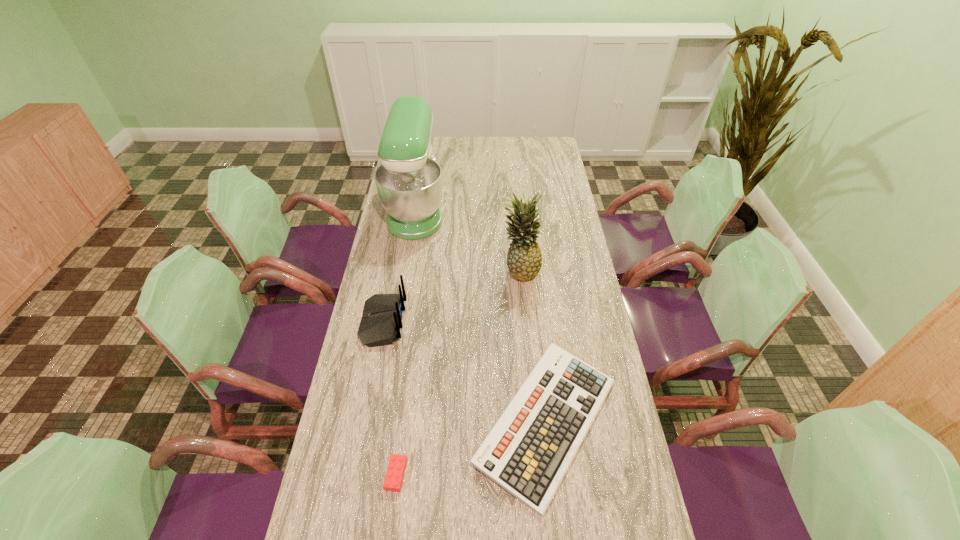
Image resolution: width=960 pixels, height=540 pixels. I want to click on blank space located on the back of the third farthest object, so click(507, 322).

You are a GUI agent. You are given a task and a screenshot of the screen. Output one action in this format:
    pyautogui.click(x=<x>, y=<y>)
    Task: Click on the vacant space located on the back of the fourth tallest object
    This screenshot has width=960, height=540.
    Given the screenshot: What is the action you would take?
    pyautogui.click(x=530, y=267)

Find the location of `free location located 0.370m on the back of the shortest object`. free location located 0.370m on the back of the shortest object is located at coordinates (413, 342).

The width and height of the screenshot is (960, 540). Identify the location of mixer that is at the left edge. pos(409,180).

The image size is (960, 540). I want to click on router located in the left edge section of the desktop, so click(x=382, y=313).

Locate an element on the screen. The image size is (960, 540). Lego that is at the left edge is located at coordinates (394, 477).

You are a GUI agent. You are given a task and a screenshot of the screen. Output one action in this format:
    pyautogui.click(x=<x>, y=<y>)
    Task: Click on the object that is at the right edge
    
    Given the screenshot: What is the action you would take?
    pyautogui.click(x=530, y=448)

Image resolution: width=960 pixels, height=540 pixels. In the image, there is a desktop. In order to click on vacant space at the left edge in this screenshot , I will do pyautogui.click(x=341, y=500).

This screenshot has width=960, height=540. What are the coordinates of `vacant space at the right edge` in the screenshot? It's located at (588, 334).

Image resolution: width=960 pixels, height=540 pixels. I want to click on free space at the far right corner of the desktop, so click(x=550, y=145).